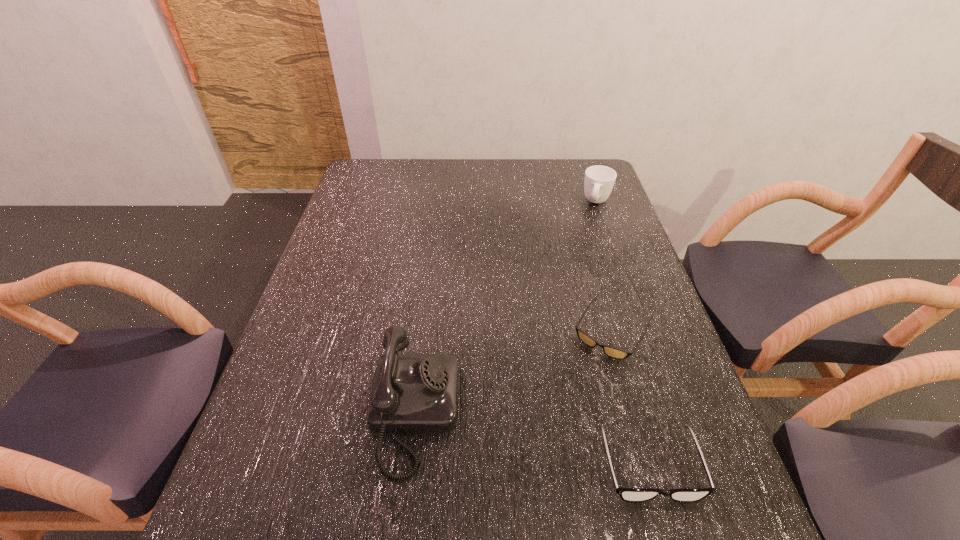
Locate an element on the screen. vacant area situated 0.270m with the handle on the side of the farthest object is located at coordinates pos(582,265).

The image size is (960, 540). I want to click on vacant region located with the handle on the side of the farthest object, so click(x=592, y=226).

The image size is (960, 540). I want to click on vacant point located 0.200m with the handle on the side of the farthest object, so click(586, 250).

Image resolution: width=960 pixels, height=540 pixels. Identify the location of object present at the far edge. (599, 180).

Image resolution: width=960 pixels, height=540 pixels. In order to click on telephone that is at the near edge in this screenshot , I will do `click(411, 393)`.

At what (x,y) coordinates should I click in order to perform the action: click on spectacles present at the near edge. Please return your answer as a coordinate pair (x, y). This screenshot has width=960, height=540. Looking at the image, I should click on (626, 494).

The image size is (960, 540). I want to click on spectacles at the right edge, so click(626, 494).

Locate an element on the screen. The height and width of the screenshot is (540, 960). sunglasses that is at the right edge is located at coordinates (610, 351).

Identify the location of cup that is positioned at the right edge. (599, 180).

Identify the location of object that is at the far right corner. This screenshot has height=540, width=960. (599, 180).